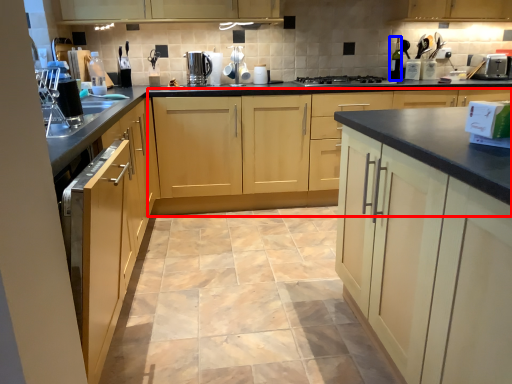
Question: Among these objects, which one is nearest to the camera, cabinetry (highlighted by a red box) or bottle (highlighted by a blue box)?

Choices:
 (A) cabinetry
 (B) bottle

Answer: (A)